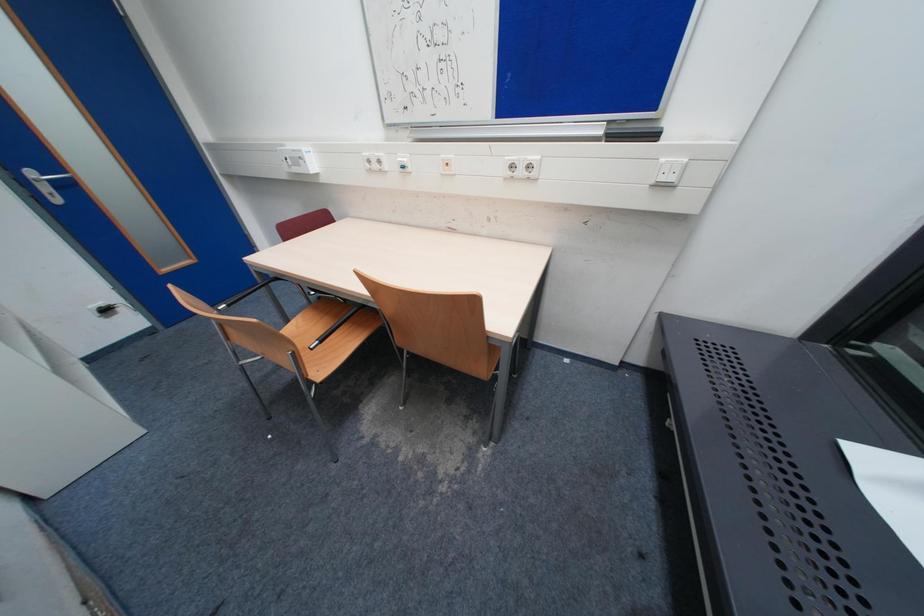
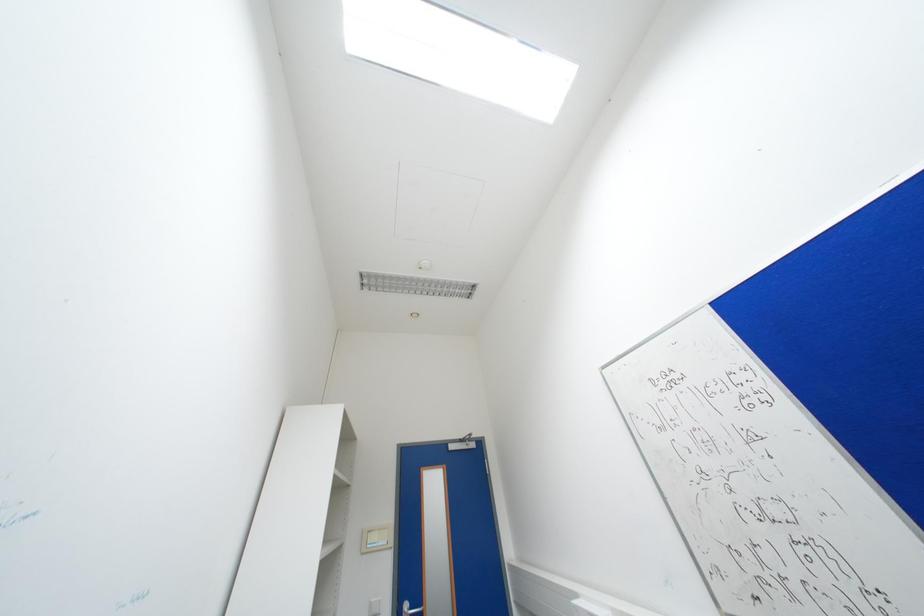
Based on the continuous images, in which direction is the camera rotating?

The camera rotated toward left-up.